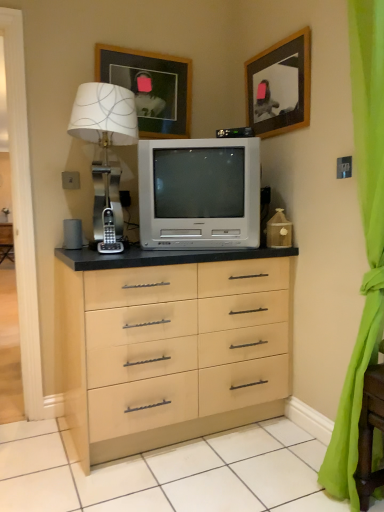
Identify the location of wooden framed picture at upper center, positioned as the first picture frame in left-to-right order. (151, 88).

Which object is more forward, wooden picture frame at upper center, acting as the 2th picture frame starting from the left, or wooden framed picture at upper center, positioned as the first picture frame in left-to-right order?

wooden picture frame at upper center, acting as the 2th picture frame starting from the left.

Which is behind, point (268, 120) or point (104, 55)?

The point (268, 120) is more distant.

Based on their positions, is wooden picture frame at upper center, acting as the 2th picture frame starting from the left, located to the left or right of wooden framed picture at upper center, positioned as the first picture frame in left-to-right order?

From the image, it's evident that wooden picture frame at upper center, acting as the 2th picture frame starting from the left, is to the right of wooden framed picture at upper center, positioned as the first picture frame in left-to-right order.

Is wooden picture frame at upper center, acting as the 2th picture frame starting from the left, turned away from wooden framed picture at upper center, positioned as the first picture frame in left-to-right order?

That's not correct — wooden picture frame at upper center, acting as the 2th picture frame starting from the left, is not looking away from wooden framed picture at upper center, positioned as the first picture frame in left-to-right order.

Is green sheer curtain at right positioned with its back to metallic silver table lamp at left?

No, green sheer curtain at right's orientation is not away from metallic silver table lamp at left.

Is green sheer curtain at right beside metallic silver table lamp at left?

No, green sheer curtain at right is not with metallic silver table lamp at left.

Considering the sizes of green sheer curtain at right and metallic silver table lamp at left in the image, is green sheer curtain at right taller or shorter than metallic silver table lamp at left?

Clearly, green sheer curtain at right is taller compared to metallic silver table lamp at left.

How far apart are green sheer curtain at right and metallic silver table lamp at left?

A distance of 1.16 meters exists between green sheer curtain at right and metallic silver table lamp at left.

Can you confirm if metallic silver table lamp at left is taller than white plastic television at center?

Yes.

Is metallic silver table lamp at left located outside white plastic television at center?

Absolutely, metallic silver table lamp at left is external to white plastic television at center.

Is metallic silver table lamp at left turned away from white plastic television at center?

metallic silver table lamp at left is not turned away from white plastic television at center.

Considering their positions, is metallic silver table lamp at left located in front of or behind wooden framed picture at upper center, the 2th picture frame from the right?

Visually, metallic silver table lamp at left is located in front of wooden framed picture at upper center, the 2th picture frame from the right.

Is metallic silver table lamp at left smaller than wooden framed picture at upper center, positioned as the first picture frame in left-to-right order?

Actually, metallic silver table lamp at left might be larger than wooden framed picture at upper center, positioned as the first picture frame in left-to-right order.

From the image's perspective, which is below, metallic silver table lamp at left or wooden framed picture at upper center, positioned as the first picture frame in left-to-right order?

From the image's view, metallic silver table lamp at left is below.

From a real-world perspective, between metallic silver table lamp at left and wooden framed picture at upper center, the 2th picture frame from the right, who is vertically higher?

wooden framed picture at upper center, the 2th picture frame from the right, is physically above.

Choose the correct answer: Is wooden picture frame at upper center, acting as the 2th picture frame starting from the left, inside white plastic television at center or outside it?

wooden picture frame at upper center, acting as the 2th picture frame starting from the left, is not enclosed by white plastic television at center.

In the image, is wooden picture frame at upper center, which appears as the 1th picture frame when viewed from the right, on the left side or the right side of white plastic television at center?

wooden picture frame at upper center, which appears as the 1th picture frame when viewed from the right, is to the right of white plastic television at center.

Is wooden picture frame at upper center, acting as the 2th picture frame starting from the left, positioned with its back to white plastic television at center?

No, wooden picture frame at upper center, acting as the 2th picture frame starting from the left, is not facing away from white plastic television at center.

From a real-world perspective, between wooden picture frame at upper center, which appears as the 1th picture frame when viewed from the right, and white plastic television at center, who is vertically higher?

wooden picture frame at upper center, which appears as the 1th picture frame when viewed from the right.

Is white plastic television at center closer to the viewer compared to metallic silver table lamp at left?

No, white plastic television at center is further to the viewer.

Image resolution: width=384 pixels, height=512 pixels. In order to click on television that is below the metallic silver table lamp at left (from the image's perspective) in this screenshot , I will do `click(199, 193)`.

Is metallic silver table lamp at left at the back of white plastic television at center?

white plastic television at center does not have its back to metallic silver table lamp at left.

Is white plastic television at center positioned far away from metallic silver table lamp at left?

No, white plastic television at center is in close proximity to metallic silver table lamp at left.

Can we say wooden picture frame at upper center, acting as the 2th picture frame starting from the left, lies outside green sheer curtain at right?

wooden picture frame at upper center, acting as the 2th picture frame starting from the left, lies outside green sheer curtain at right's area.

From a real-world perspective, is wooden picture frame at upper center, which appears as the 1th picture frame when viewed from the right, positioned above or below green sheer curtain at right?

In terms of real-world spatial position, wooden picture frame at upper center, which appears as the 1th picture frame when viewed from the right, is above green sheer curtain at right.

Is wooden picture frame at upper center, which appears as the 1th picture frame when viewed from the right, touching green sheer curtain at right?

No, wooden picture frame at upper center, which appears as the 1th picture frame when viewed from the right, is not touching green sheer curtain at right.

Considering their positions, is wooden picture frame at upper center, acting as the 2th picture frame starting from the left, located in front of or behind green sheer curtain at right?

Visually, wooden picture frame at upper center, acting as the 2th picture frame starting from the left, is located behind green sheer curtain at right.

Where is `picture frame on the left of wooden picture frame at upper center, acting as the 2th picture frame starting from the left`? picture frame on the left of wooden picture frame at upper center, acting as the 2th picture frame starting from the left is located at coordinates (151, 88).

The width and height of the screenshot is (384, 512). In order to click on curtain below the metallic silver table lamp at left (from a real-world perspective) in this screenshot , I will do `click(365, 239)`.

When comparing their distances from wooden picture frame at upper center, which appears as the 1th picture frame when viewed from the right, does wooden framed picture at upper center, positioned as the first picture frame in left-to-right order, or white plastic television at center seem closer?

white plastic television at center is positioned closer to the anchor wooden picture frame at upper center, which appears as the 1th picture frame when viewed from the right.

Which object lies further to the anchor point wooden framed picture at upper center, positioned as the first picture frame in left-to-right order, metallic silver table lamp at left or white plastic television at center?

Among the two, white plastic television at center is located further to wooden framed picture at upper center, positioned as the first picture frame in left-to-right order.

When comparing their distances from wooden picture frame at upper center, which appears as the 1th picture frame when viewed from the right, does metallic silver table lamp at left or wooden framed picture at upper center, the 2th picture frame from the right, seem further?

Among the two, metallic silver table lamp at left is located further to wooden picture frame at upper center, which appears as the 1th picture frame when viewed from the right.

Looking at the image, which one is located closer to green sheer curtain at right, wooden picture frame at upper center, acting as the 2th picture frame starting from the left, or metallic silver table lamp at left?

Among the two, wooden picture frame at upper center, acting as the 2th picture frame starting from the left, is located nearer to green sheer curtain at right.

From the image, which object appears to be farther from metallic silver table lamp at left, wooden picture frame at upper center, acting as the 2th picture frame starting from the left, or white plastic television at center?

wooden picture frame at upper center, acting as the 2th picture frame starting from the left, is positioned further to the anchor metallic silver table lamp at left.

Estimate the real-world distances between objects in this image. Which object is closer to wooden picture frame at upper center, which appears as the 1th picture frame when viewed from the right, green sheer curtain at right or white plastic television at center?

white plastic television at center.

Based on their spatial positions, is white plastic television at center or green sheer curtain at right further from wooden picture frame at upper center, acting as the 2th picture frame starting from the left?

Based on the image, green sheer curtain at right appears to be further to wooden picture frame at upper center, acting as the 2th picture frame starting from the left.

Which object lies nearer to the anchor point wooden framed picture at upper center, the 2th picture frame from the right, white plastic television at center or metallic silver table lamp at left?

metallic silver table lamp at left.

Locate an element on the screen. The height and width of the screenshot is (512, 384). table lamp between wooden framed picture at upper center, positioned as the first picture frame in left-to-right order, and white plastic television at center, in the vertical direction is located at coordinates (105, 152).

At what (x,y) coordinates should I click in order to perform the action: click on television located between wooden framed picture at upper center, positioned as the first picture frame in left-to-right order, and wooden picture frame at upper center, acting as the 2th picture frame starting from the left, in the left-right direction. Please return your answer as a coordinate pair (x, y). The height and width of the screenshot is (512, 384). Looking at the image, I should click on (199, 193).

Where is `television located between green sheer curtain at right and wooden framed picture at upper center, positioned as the first picture frame in left-to-right order, in the depth direction`? television located between green sheer curtain at right and wooden framed picture at upper center, positioned as the first picture frame in left-to-right order, in the depth direction is located at coordinates (199, 193).

Locate an element on the screen. This screenshot has width=384, height=512. television between metallic silver table lamp at left and wooden picture frame at upper center, which appears as the 1th picture frame when viewed from the right, in the horizontal direction is located at coordinates (199, 193).